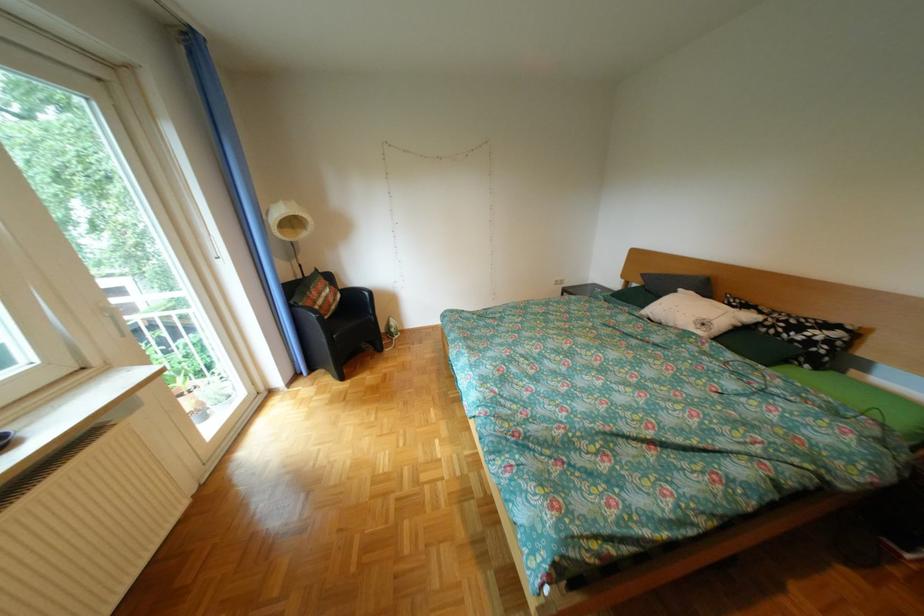
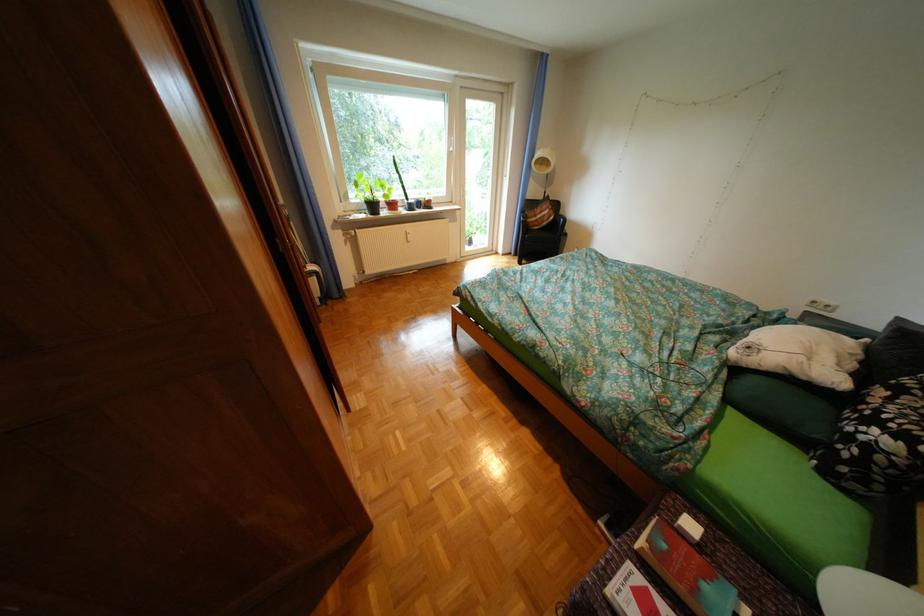
Find the pixel in the second image that matches point (718, 325) in the first image.

(763, 349)